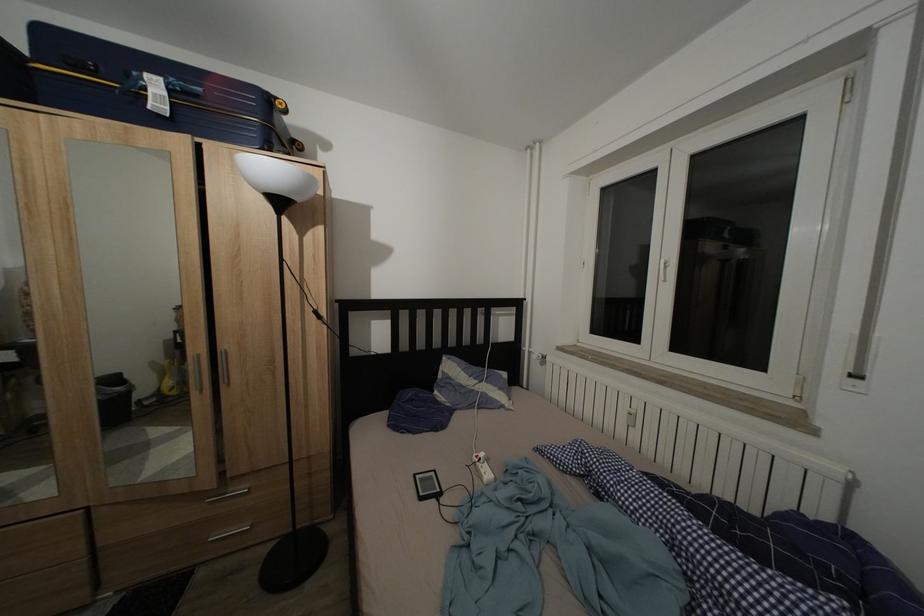
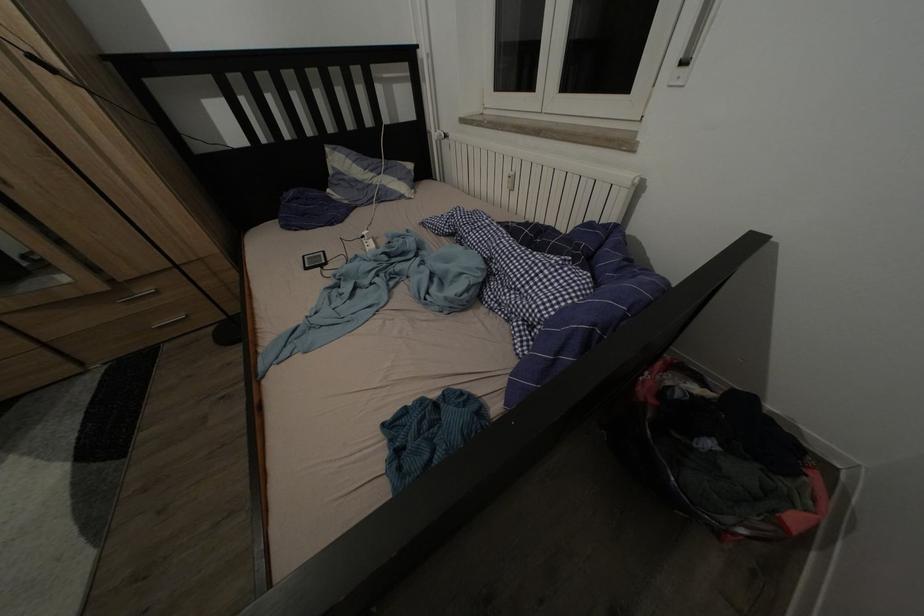
Where in the second image is the point corresponding to [490,461] from the first image?

(372, 238)